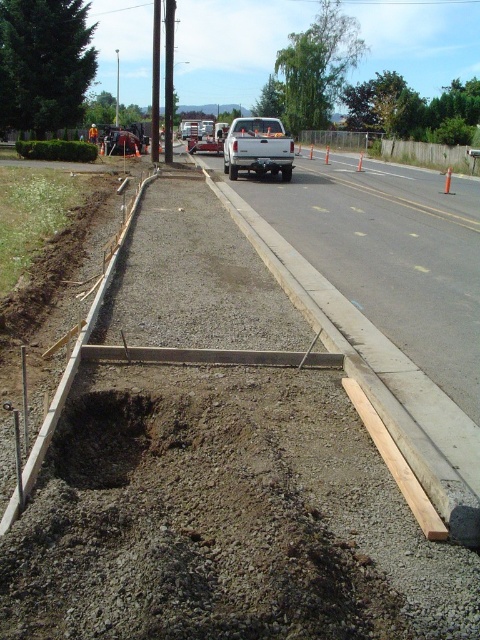
Consider the image. Is brown gravel at center bigger than brushed metal truck at center?

No.

Can you confirm if brown gravel at center is wider than brushed metal truck at center?

No, brown gravel at center is not wider than brushed metal truck at center.

You are a GUI agent. You are given a task and a screenshot of the screen. Output one action in this format:
    pyautogui.click(x=<x>, y=<y>)
    Task: Click on the brown gravel at center
    
    Given the screenshot: What is the action you would take?
    pyautogui.click(x=194, y=515)

Find the location of `brown gravel at center`. brown gravel at center is located at coordinates (194, 515).

Measure the distance between white matte truck at center and camera.

white matte truck at center is 21.26 meters away from camera.

Is white matte truck at center taller than brushed metal truck at center?

Yes.

Between point (282, 179) and point (135, 147), which one is positioned in front?

Point (282, 179) is in front.

At what (x,y) coordinates should I click in order to perform the action: click on white matte truck at center. Please return your answer as a coordinate pair (x, y). This screenshot has height=640, width=480. Looking at the image, I should click on (257, 147).

Which is above, brown dirt hole at center or orange safety vest at center?

orange safety vest at center is higher up.

Does brown dirt hole at center have a greater width compared to orange safety vest at center?

Incorrect, brown dirt hole at center's width does not surpass orange safety vest at center's.

The width and height of the screenshot is (480, 640). Identify the location of brown dirt hole at center. (103, 436).